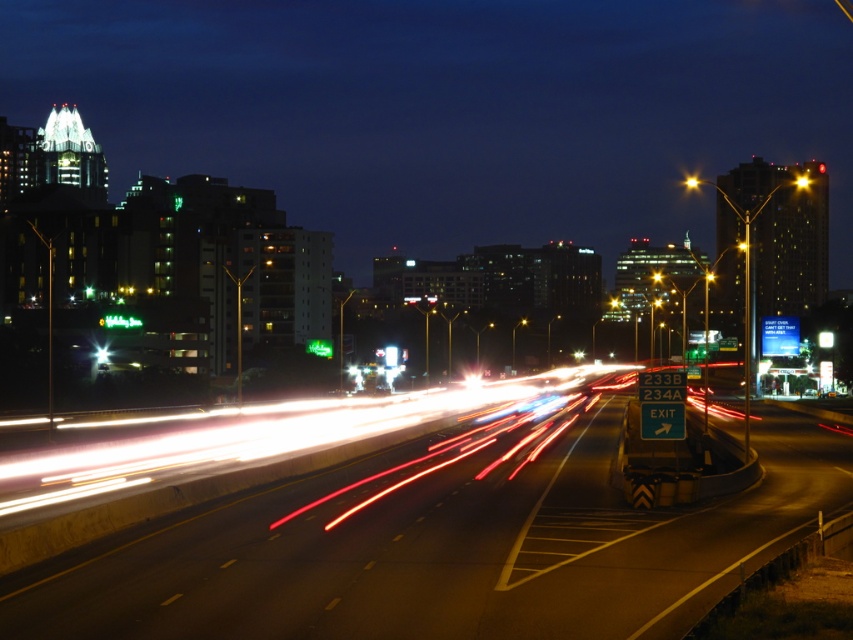
You are a drone operator trying to capture the metallic asphalt highway at center. You have a camera with a 100mm lens. The point you are focusing on is at coordinate point (440, 547). Is this point on the metallic asphalt highway at center?

Yes, the point (440, 547) corresponds to the metallic asphalt highway at center, so the drone operator can focus there.

Based on the photo, you are a pedestrian standing at the edge of the metallic asphalt highway at center. You want to cross the highway to reach the buildings in the middle ground. Considering the distance of the highway, is it possible to cross safely in one breath?

The metallic asphalt highway at center is 9.05 meters away from the viewer. Since the distance is relatively short, it is possible to cross safely in one breath.